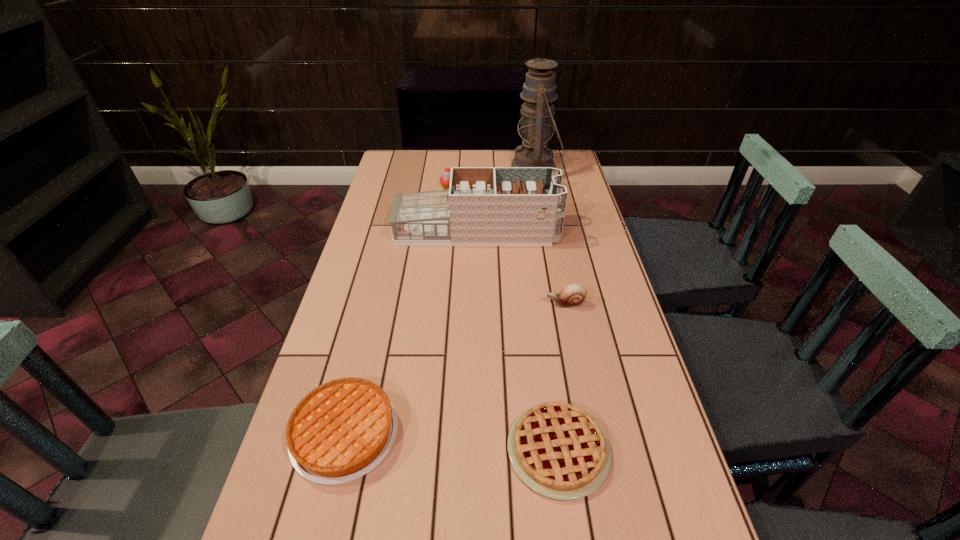
Locate an element on the screen. This screenshot has width=960, height=540. pie that is positioned at the left edge is located at coordinates (341, 430).

This screenshot has height=540, width=960. In order to click on oil lamp that is positioned at the right edge in this screenshot , I will do `click(537, 122)`.

Where is `dollhouse at the right edge`? dollhouse at the right edge is located at coordinates (483, 206).

The image size is (960, 540). In order to click on escargot that is positioned at the right edge in this screenshot , I will do `click(573, 295)`.

This screenshot has height=540, width=960. What are the coordinates of `pie that is at the right edge` in the screenshot? It's located at (558, 450).

You are a GUI agent. You are given a task and a screenshot of the screen. Output one action in this format:
    pyautogui.click(x=<x>, y=<y>)
    Task: Click on the object that is at the far right corner
    Image resolution: width=960 pixels, height=540 pixels.
    Given the screenshot: What is the action you would take?
    pyautogui.click(x=537, y=122)

The height and width of the screenshot is (540, 960). Find the location of `vacant space at the far edge of the desktop`. vacant space at the far edge of the desktop is located at coordinates (462, 166).

Find the location of a particular element. This screenshot has width=960, height=540. free space at the left edge of the desktop is located at coordinates (381, 237).

At what (x,y) coordinates should I click in order to perform the action: click on free space at the right edge of the desktop. Please return your answer as a coordinate pair (x, y). This screenshot has width=960, height=540. Looking at the image, I should click on (616, 331).

Identify the location of vacant position at the far left corner of the desktop. This screenshot has width=960, height=540. (419, 171).